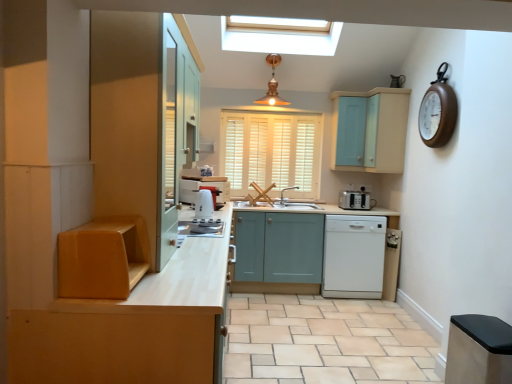
Question: Is point [x=224, y=130] closer or farther from the camera than point [x=360, y=193]?

Choices:
 (A) closer
 (B) farther

Answer: (B)

Question: In terms of size, does white wood blinds at center appear bigger or smaller than white plastic toaster at right?

Choices:
 (A) small
 (B) big

Answer: (B)

Question: Which is farther from the beige tile at lower right?

Choices:
 (A) matte wood cabinet at left, marked as the fourth cabinetry in a right-to-left arrangement
 (B) wooden clock at upper right
 (C) white plastic toaster at right
 (D) copper/textured pendant light at upper center
 (E) satin silver toaster at center

Answer: (D)

Question: Estimate the real-world distances between objects in this image. Which object is farther from the beige tile at lower right?

Choices:
 (A) copper/textured pendant light at upper center
 (B) matte teal cabinet at center, which is the third cabinetry in right-to-left order
 (C) wooden clock at upper right
 (D) stainless steel trash can at lower right, the fourth cabinetry from the left
 (E) white wood blinds at center

Answer: (A)